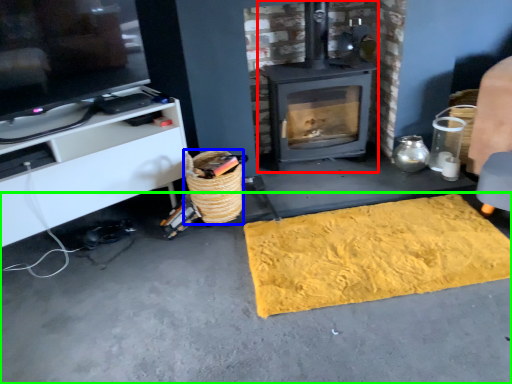
Question: Which is farther away from wood burning stove (highlighted by a red box)? basket (highlighted by a blue box) or concrete (highlighted by a green box)?

Choices:
 (A) basket
 (B) concrete

Answer: (B)